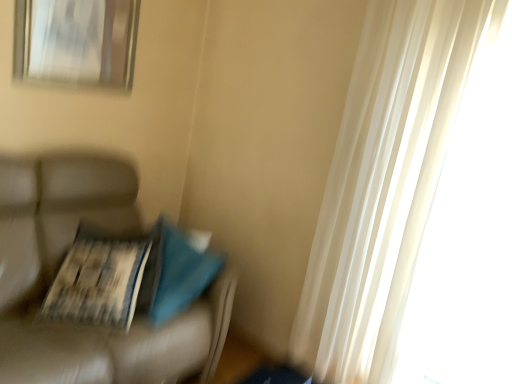
Question: From their relative heights in the image, would you say metallic silver picture frame at upper left is taller or shorter than printed paper magazine at left?

Choices:
 (A) short
 (B) tall

Answer: (B)

Question: Considering the positions of point (26, 57) and point (77, 228), is point (26, 57) closer or farther from the camera than point (77, 228)?

Choices:
 (A) closer
 (B) farther

Answer: (A)

Question: Which object is positioned farthest from the leather couch at left?

Choices:
 (A) printed paper magazine at left
 (B) metallic silver picture frame at upper left

Answer: (B)

Question: Based on their relative distances, which object is nearer to the leather couch at left?

Choices:
 (A) printed paper magazine at left
 (B) metallic silver picture frame at upper left

Answer: (A)